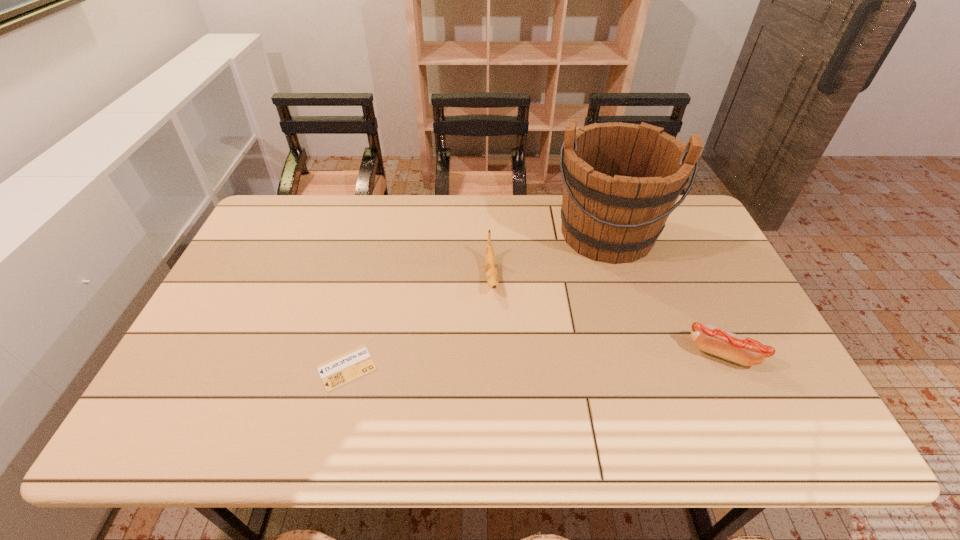
Where is `free space on the desktop that is between the leftmost object and the sausage and is positioned on the peel of the second object from left to right from the top`? Image resolution: width=960 pixels, height=540 pixels. free space on the desktop that is between the leftmost object and the sausage and is positioned on the peel of the second object from left to right from the top is located at coordinates (502, 362).

Locate an element on the screen. This screenshot has height=540, width=960. free space on the desktop that is between the shortest object and the sausage and is positioned on the side of the wine bucket with the handle for carrying is located at coordinates (593, 358).